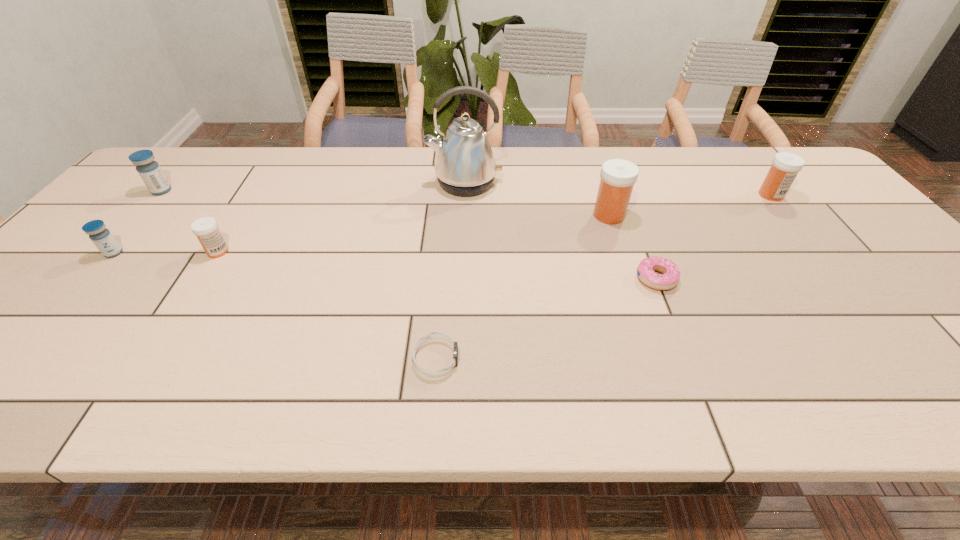
The width and height of the screenshot is (960, 540). Find the location of `free spot between the nearer blue medicine and the wristband`. free spot between the nearer blue medicine and the wristband is located at coordinates (275, 306).

I want to click on empty location between the nearest white medicine and the tallest object, so point(341,217).

Where is `vacant space in between the rightmost medicine and the wristband`? vacant space in between the rightmost medicine and the wristband is located at coordinates (603, 277).

Find the location of a particular element. The width and height of the screenshot is (960, 540). free space that is in between the tallest object and the wristband is located at coordinates (450, 271).

Where is `free spot between the pink doughnut and the smaller blue medicine`? The width and height of the screenshot is (960, 540). free spot between the pink doughnut and the smaller blue medicine is located at coordinates (385, 266).

You are a GUI agent. You are given a task and a screenshot of the screen. Output one action in this format:
    pyautogui.click(x=<x>, y=<y>)
    Task: Click on the empty location between the wristband and the fourth medicine from left to right
    
    Given the screenshot: What is the action you would take?
    pyautogui.click(x=522, y=287)

Locate an element on the screen. free spot between the farther blue medicine and the second white medicine from left to right is located at coordinates (385, 203).

The height and width of the screenshot is (540, 960). Identify the location of object that is the second nearest to the pink doughnut. (465, 165).

Where is `object that can be found as the second closest to the farther blue medicine`? object that can be found as the second closest to the farther blue medicine is located at coordinates (206, 229).

The width and height of the screenshot is (960, 540). Find the location of `medicine that is the second closest to the smallest white medicine`. medicine that is the second closest to the smallest white medicine is located at coordinates (149, 170).